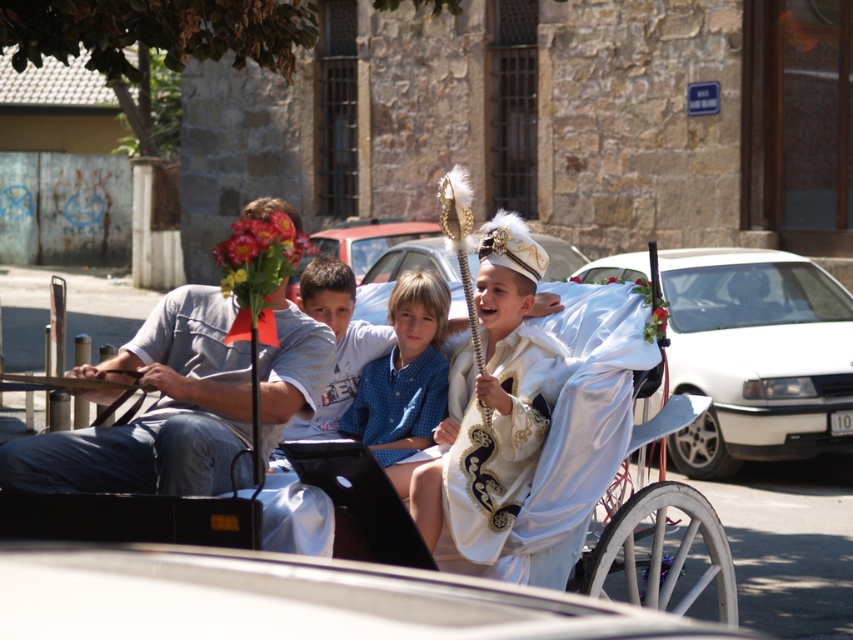
You are a delivery person trying to navigate through the narrow alley behind the stone building. The alley is only as wide as the white satin horse cart at center. Can your delivery van, which is as wide as the gray cotton shirt at left, fit through the alley?

The white satin horse cart at center is wider than the gray cotton shirt at left. Since the alley is as wide as the horse cart, the delivery van, being narrower than the shirt, can fit through the alley.

You are a photographer standing on the sidewalk. You want to take a picture of the white satin horse cart at center and the gray cotton shirt at left. Which object should you focus on first to ensure both are in frame?

You should focus on the white satin horse cart at center first because it is in front of the gray cotton shirt at left, so you can adjust the camera angle to include both in the frame.